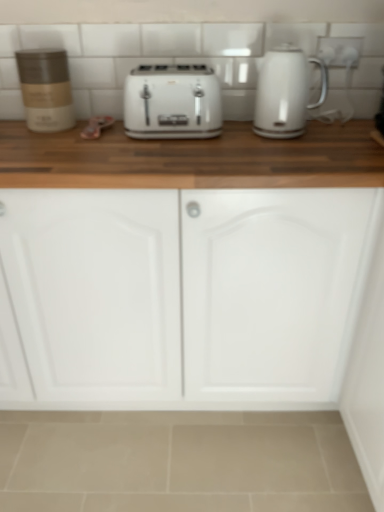
Question: Considering the relative positions of white glossy toaster at center and white matte cabinet doors at center in the image provided, is white glossy toaster at center to the right of white matte cabinet doors at center from the viewer's perspective?

Choices:
 (A) no
 (B) yes

Answer: (B)

Question: Does white glossy toaster at center lie behind white matte cabinet doors at center?

Choices:
 (A) no
 (B) yes

Answer: (B)

Question: Is white glossy toaster at center in contact with white matte cabinet doors at center?

Choices:
 (A) no
 (B) yes

Answer: (A)

Question: From a real-world perspective, is white glossy toaster at center located higher than white matte cabinet doors at center?

Choices:
 (A) yes
 (B) no

Answer: (A)

Question: Can you confirm if white glossy toaster at center is bigger than white matte cabinet doors at center?

Choices:
 (A) no
 (B) yes

Answer: (A)

Question: Is white matte cabinet doors at center in front of or behind matte brown container at left in the image?

Choices:
 (A) front
 (B) behind

Answer: (A)

Question: Looking at the image, does white matte cabinet doors at center seem bigger or smaller compared to matte brown container at left?

Choices:
 (A) small
 (B) big

Answer: (B)

Question: In terms of height, does white matte cabinet doors at center look taller or shorter compared to matte brown container at left?

Choices:
 (A) short
 (B) tall

Answer: (B)

Question: Considering the positions of point (273, 287) and point (46, 55), is point (273, 287) closer or farther from the camera than point (46, 55)?

Choices:
 (A) farther
 (B) closer

Answer: (B)

Question: From the image's perspective, is white glossy toaster at center above or below white glossy electric outlet at upper right?

Choices:
 (A) above
 (B) below

Answer: (B)

Question: From their relative heights in the image, would you say white glossy toaster at center is taller or shorter than white glossy electric outlet at upper right?

Choices:
 (A) short
 (B) tall

Answer: (B)

Question: Is point (198, 94) closer or farther from the camera than point (319, 54)?

Choices:
 (A) farther
 (B) closer

Answer: (B)

Question: Is white glossy toaster at center spatially inside white glossy electric outlet at upper right, or outside of it?

Choices:
 (A) outside
 (B) inside

Answer: (A)

Question: From a real-world perspective, is white glossy toaster at center above or below white glossy electric kettle at upper right?

Choices:
 (A) below
 (B) above

Answer: (A)

Question: Looking at the image, does white glossy toaster at center seem bigger or smaller compared to white glossy electric kettle at upper right?

Choices:
 (A) big
 (B) small

Answer: (A)